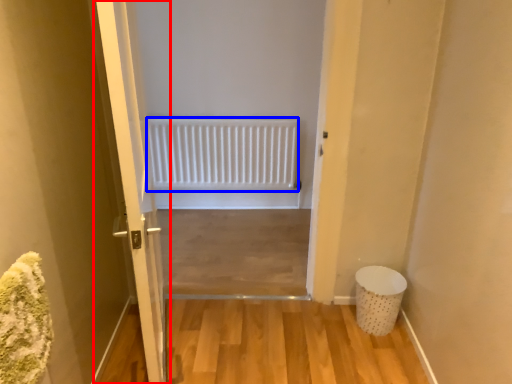
Question: Which object appears closest to the camera in this image, door (highlighted by a red box) or radiator (highlighted by a blue box)?

Choices:
 (A) door
 (B) radiator

Answer: (A)